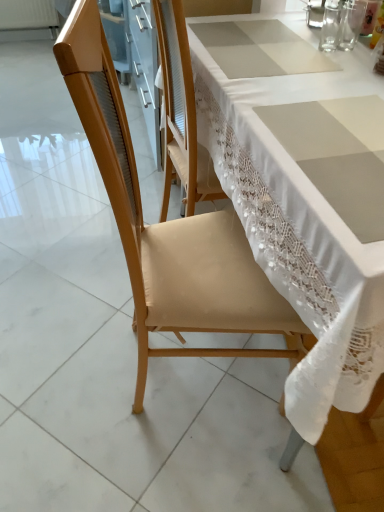
Find the location of a particular element. vacant location behind transparent glass at upper right, the 1th tableware from the right is located at coordinates (324, 27).